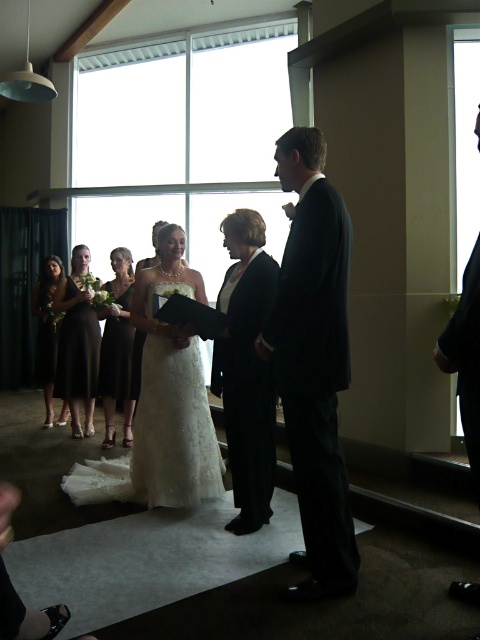
You are a photographer positioned at the back of the room. You want to capture a photo of the bride and the black satin suit at center without them overlapping in the frame. Given that they are 2.20 meters apart, can you adjust your camera angle to ensure both are fully visible and not overlapping?

Since the bride and the black satin suit at center are 2.20 meters apart, adjusting the camera angle slightly to the side or moving closer should allow both subjects to be captured without overlapping in the frame.